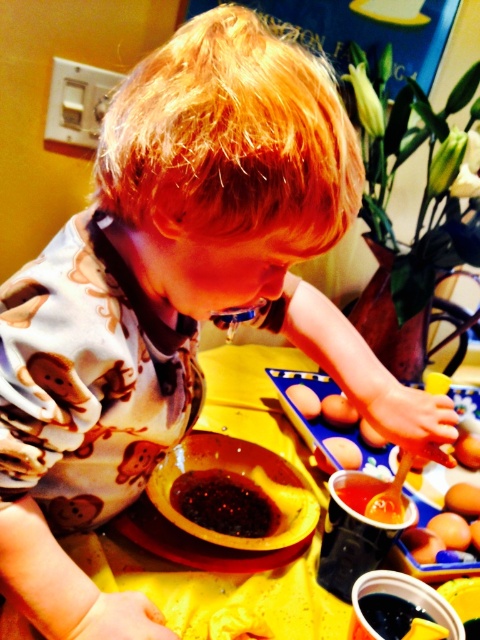
You are a parent observing your child at the table. You notice the yellow matte table at center and the smooth orange eggs at center. Which object is positioned higher from the floor?

The yellow matte table at center is located above the smooth orange eggs at center, so the yellow matte table at center is higher from the floor.

You are a chef observing the child in the scene. You need to determine which item is wider between the dark glossy sauce at center and the brown matte egg at center. Which one is wider?

The dark glossy sauce at center is wider than the brown matte egg at center according to the description.

You are a parent supervising your child during an egg dyeing activity. You notice two eggs on the table. The smooth orange eggs at center and the brown matte egg at center. Which egg is positioned lower on the table?

The smooth orange eggs at center is positioned lower because it is below the brown matte egg at center.